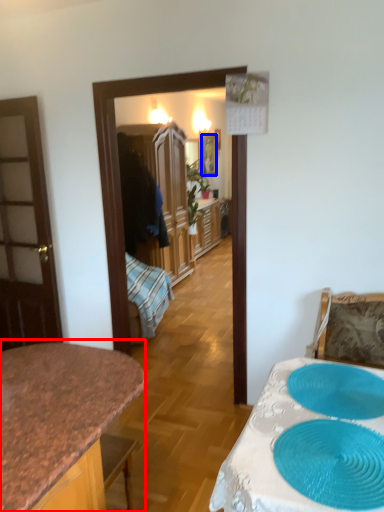
Question: Which object is closer to the camera taking this photo, countertop (highlighted by a red box) or picture frame (highlighted by a blue box)?

Choices:
 (A) countertop
 (B) picture frame

Answer: (A)